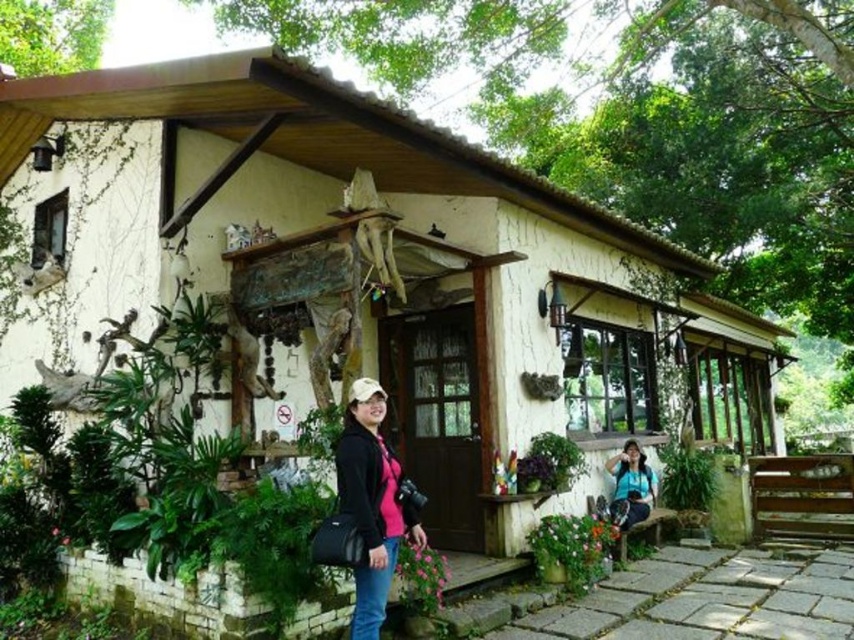
Based on the photo, can you confirm if pink matte jacket at center is positioned to the right of matte black camera at lower right?

In fact, pink matte jacket at center is to the left of matte black camera at lower right.

Identify the location of pink matte jacket at center. This screenshot has height=640, width=854. (372, 502).

The height and width of the screenshot is (640, 854). Describe the element at coordinates (372, 502) in the screenshot. I see `pink matte jacket at center` at that location.

What are the coordinates of `pink matte jacket at center` in the screenshot? It's located at (372, 502).